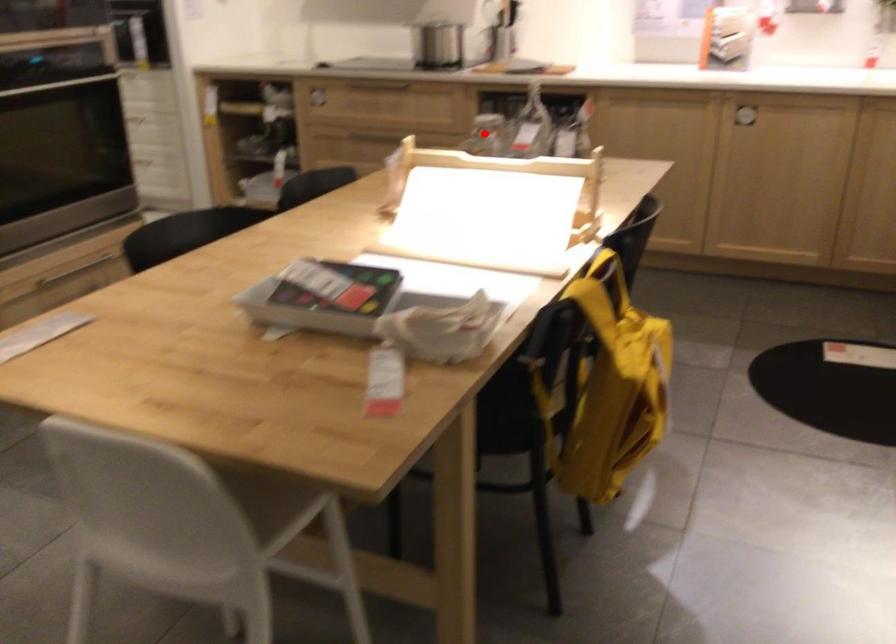
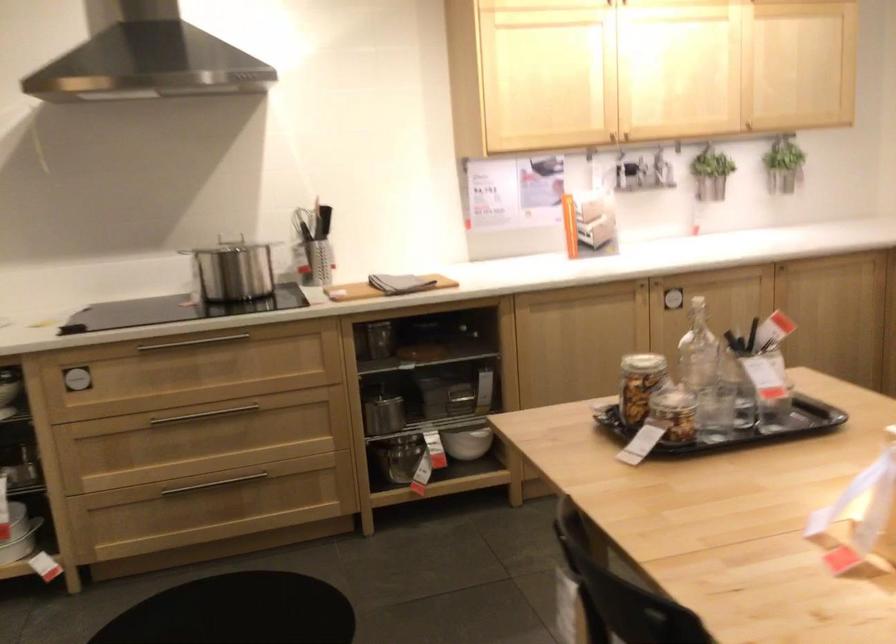
The point at the highlighted location is marked in the first image. Where is the corresponding point in the second image?

(640, 384)